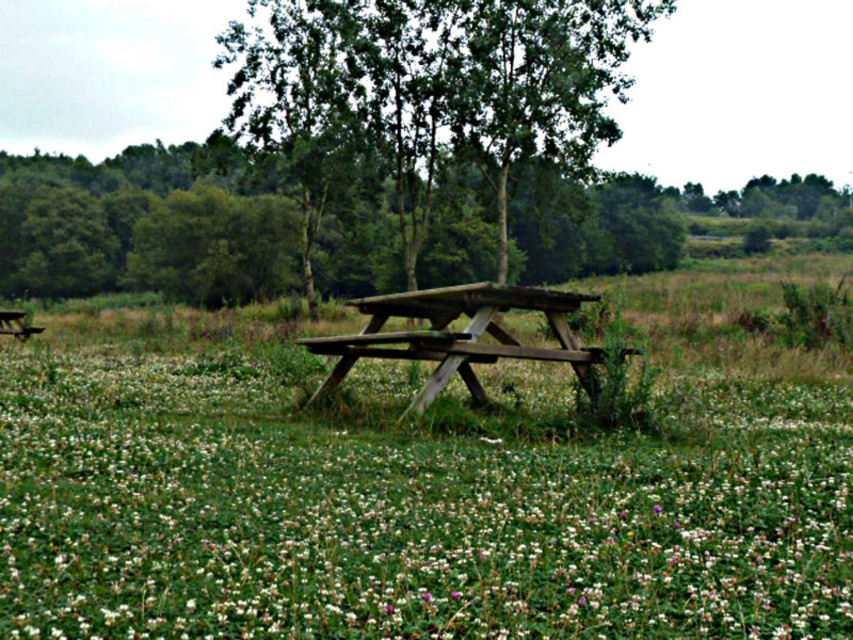
You are planning to place a small decorative pot on the grass between the white matte flower at center and the wooden picnic table at center. Based on their sizes, do you think the flower might block the view of the picnic table from this angle?

The white matte flower at center might be wider than the wooden picnic table at center, so it could potentially block the view of the picnic table depending on their exact positions and angles.

You are planning to set up a small garden in your backyard and want to ensure there is enough space between the white matte flower at center and the wooden picnic table at center. Based on the image, which object takes up more horizontal space?

The white matte flower at center has a larger size compared to the wooden picnic table at center, so it occupies more horizontal space.

You are planning to set up a tent for a small gathering. You have a tent that requires 10 square meters of space. Looking at the scene, can the area between the green wood tree at center and the wooden picnic table at center accommodate your tent?

The green wood tree at center is larger than the wooden picnic table at center, but the exact distance between them isn